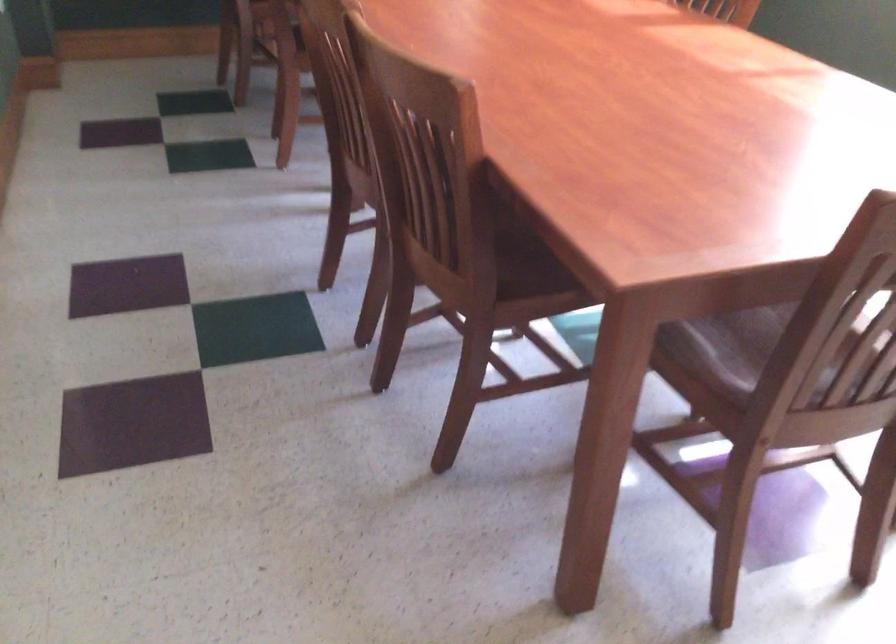
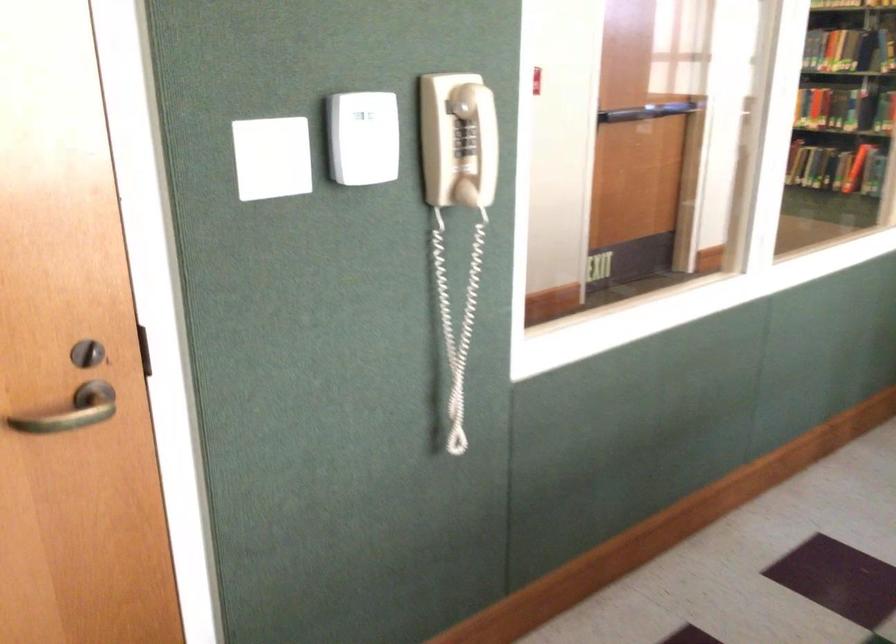
Question: Based on the continuous images, in which direction is the camera rotating? Reply with the corresponding letter.

Choices:
 (A) Left
 (B) Right
 (C) Up
 (D) Down

Answer: (A)